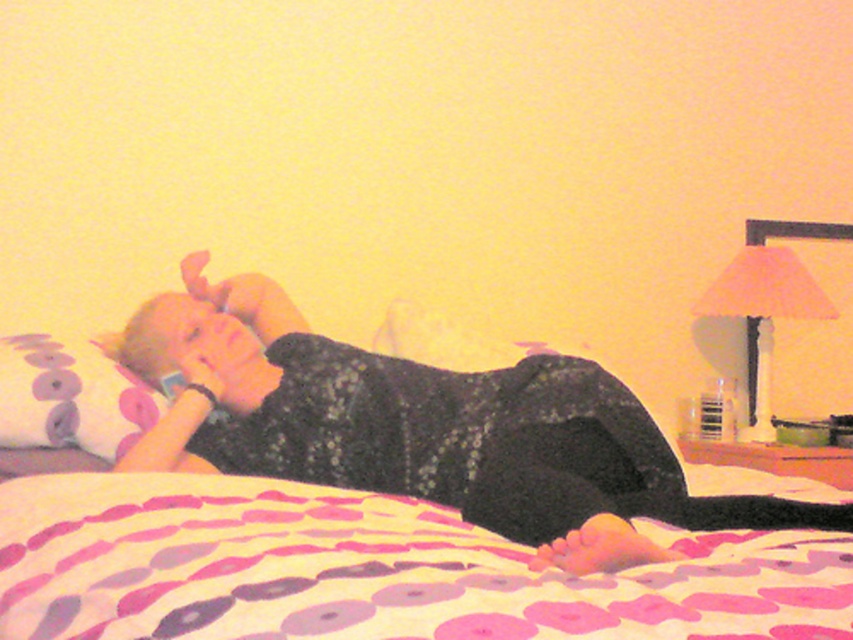
You are organizing a photo shoot and need to ensure the matte black dress at center is visible above the patterned fabric blanket at center. Based on the scene description, is this currently the case?

The patterned fabric blanket at center is below the matte black dress at center, so yes, the matte black dress at center is visible above the patterned fabric blanket at center.

You are a delivery person who needs to place a small package on the bed without waking the person. The package is 12 inches long. Can you fit it on the bed next to the patterned fabric blanket at center?

The patterned fabric blanket at center is 38.14 inches from viewer. Since the package is 12 inches long, it can be placed next to the blanket as there is sufficient space available on the bed.

You are organizing a small event and need to know which item is bigger between the patterned fabric blanket at center and the floral fabric pillow at left. Can you tell me which one is larger?

The patterned fabric blanket at center has a larger size compared to floral fabric pillow at left, so the patterned fabric blanket at center is bigger.